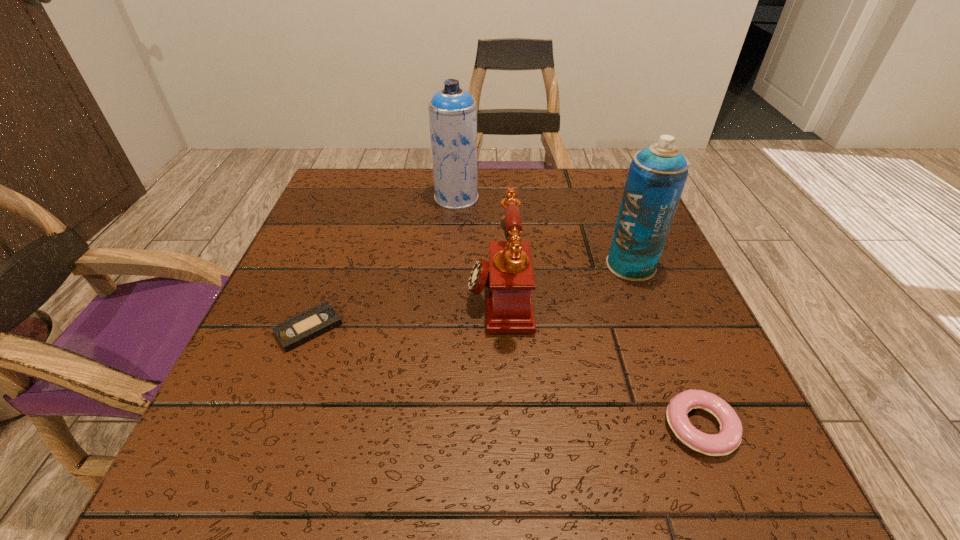
Image resolution: width=960 pixels, height=540 pixels. I want to click on free spot that satisfies the following two spatial constraints: 1. on the dial of the telephone; 2. on the left side of the second shortest object, so click(506, 427).

At what (x,y) coordinates should I click in order to perform the action: click on free space that satisfies the following two spatial constraints: 1. on the back side of the farther aerosol can; 2. on the right side of the videotape. Please return your answer as a coordinate pair (x, y). Looking at the image, I should click on (358, 198).